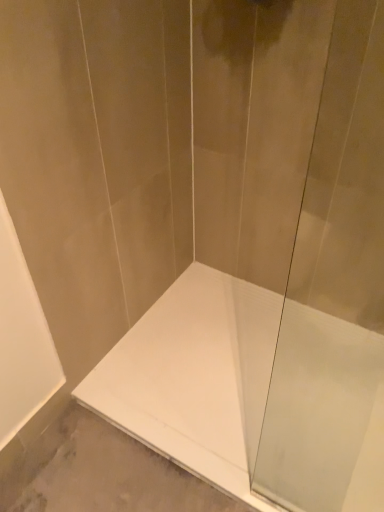
In order to click on vacant area to the left of transparent glass shower door at center in this screenshot , I will do `click(234, 476)`.